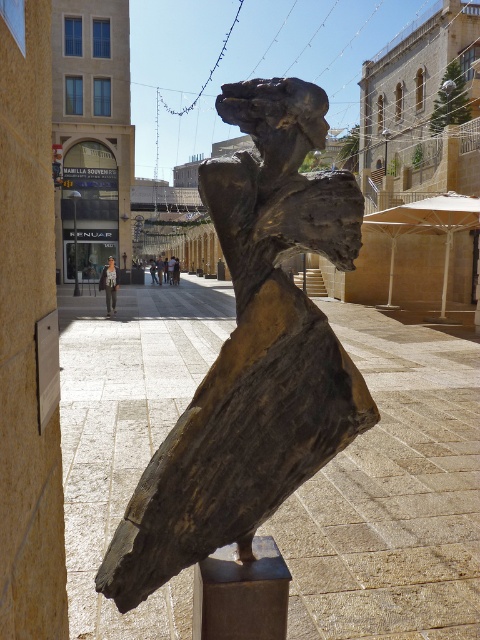
Question: Does bronze statue at center appear over light brown leather jacket at center?

Choices:
 (A) yes
 (B) no

Answer: (B)

Question: Is bronze statue at center smaller than light brown leather jacket at center?

Choices:
 (A) no
 (B) yes

Answer: (B)

Question: Which point is farther to the camera?

Choices:
 (A) bronze statue at center
 (B) light brown leather jacket at center

Answer: (B)

Question: Which point appears farthest from the camera in this image?

Choices:
 (A) coord(290,358)
 (B) coord(101,285)

Answer: (B)

Question: Is bronze statue at center wider than light brown leather jacket at center?

Choices:
 (A) no
 (B) yes

Answer: (A)